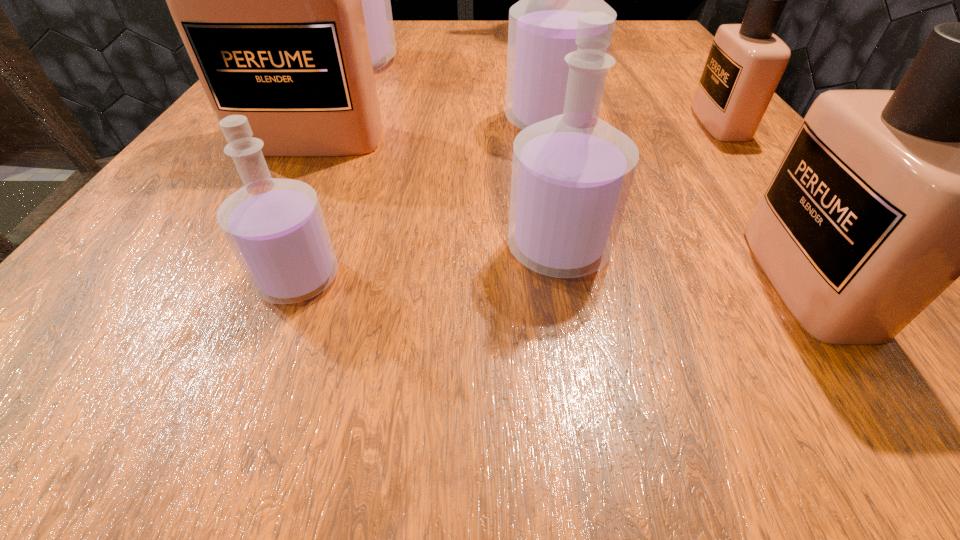
Where is `free location located 0.130m on the front-facing side of the fire extinguisher`? free location located 0.130m on the front-facing side of the fire extinguisher is located at coordinates (570, 74).

Where is `vacant space located 0.270m on the right of the farthest purple perfume`? This screenshot has width=960, height=540. vacant space located 0.270m on the right of the farthest purple perfume is located at coordinates (531, 62).

Where is `vacant space located 0.220m on the right of the second farthest purple perfume`? This screenshot has height=540, width=960. vacant space located 0.220m on the right of the second farthest purple perfume is located at coordinates (731, 122).

The width and height of the screenshot is (960, 540). In order to click on free location located on the front label of the biggest beige perfume in this screenshot , I will do `click(211, 322)`.

Where is `vacant area situated on the left of the third biggest purple perfume`? Image resolution: width=960 pixels, height=540 pixels. vacant area situated on the left of the third biggest purple perfume is located at coordinates (235, 248).

Find the location of a particular element. The width and height of the screenshot is (960, 540). vacant region located on the front label of the second smallest beige perfume is located at coordinates (x=654, y=279).

Identify the location of vacant space located on the front label of the second smallest beige perfume. (720, 279).

At what (x,y) coordinates should I click in order to perform the action: click on free space located on the front label of the second smallest beige perfume. Please return your answer as a coordinate pair (x, y). The width and height of the screenshot is (960, 540). Looking at the image, I should click on (475, 279).

The height and width of the screenshot is (540, 960). Find the location of `free space located 0.060m on the front label of the smallest beige perfume`. free space located 0.060m on the front label of the smallest beige perfume is located at coordinates pos(662,122).

Where is `vacant position located on the front label of the smallest beige perfume`? The height and width of the screenshot is (540, 960). vacant position located on the front label of the smallest beige perfume is located at coordinates (470, 122).